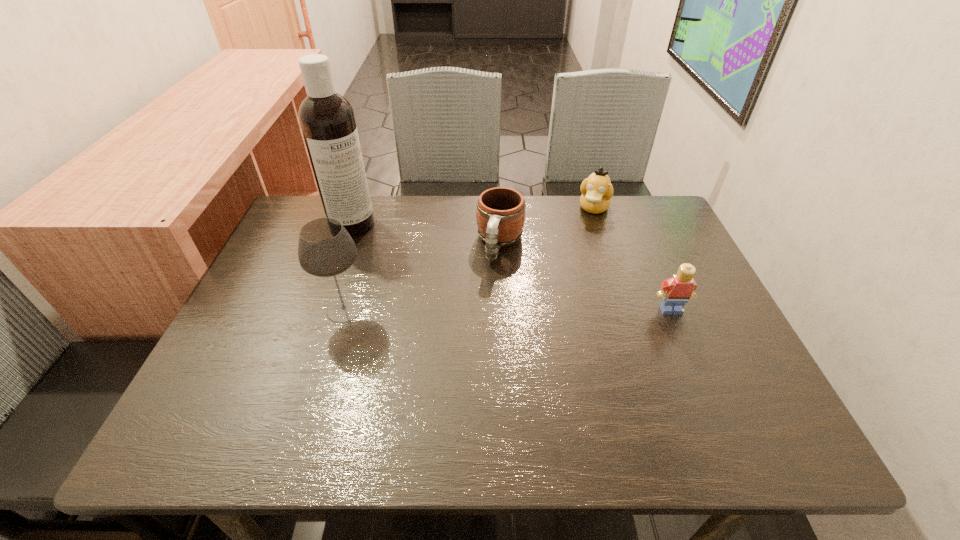
Identify the location of the fourth shortest object. (325, 249).

The height and width of the screenshot is (540, 960). What are the coordinates of `the rightmost object` in the screenshot? It's located at (675, 292).

This screenshot has height=540, width=960. I want to click on the tallest object, so click(x=327, y=120).

What are the coordinates of `the third object from left to right` in the screenshot? It's located at (500, 214).

At what (x,y) coordinates should I click in order to perform the action: click on the fourth object from left to right. Please return your answer as a coordinate pair (x, y). The height and width of the screenshot is (540, 960). Looking at the image, I should click on (597, 190).

The width and height of the screenshot is (960, 540). What are the coordinates of `vacant point located on the back of the wineglass` in the screenshot? It's located at (361, 255).

Image resolution: width=960 pixels, height=540 pixels. Find the location of `vacant area situated on the front-facing side of the rightmost object`. vacant area situated on the front-facing side of the rightmost object is located at coordinates (681, 332).

This screenshot has width=960, height=540. I want to click on vacant point located 0.370m on the label side of the dishwasher detergent, so click(x=454, y=299).

At what (x,y) coordinates should I click in order to perform the action: click on free space located 0.130m on the label side of the dishwasher detergent. Please return your answer as a coordinate pair (x, y). Looking at the image, I should click on (394, 254).

Find the location of a particular element. vacant space situated on the label side of the dishwasher detergent is located at coordinates (377, 243).